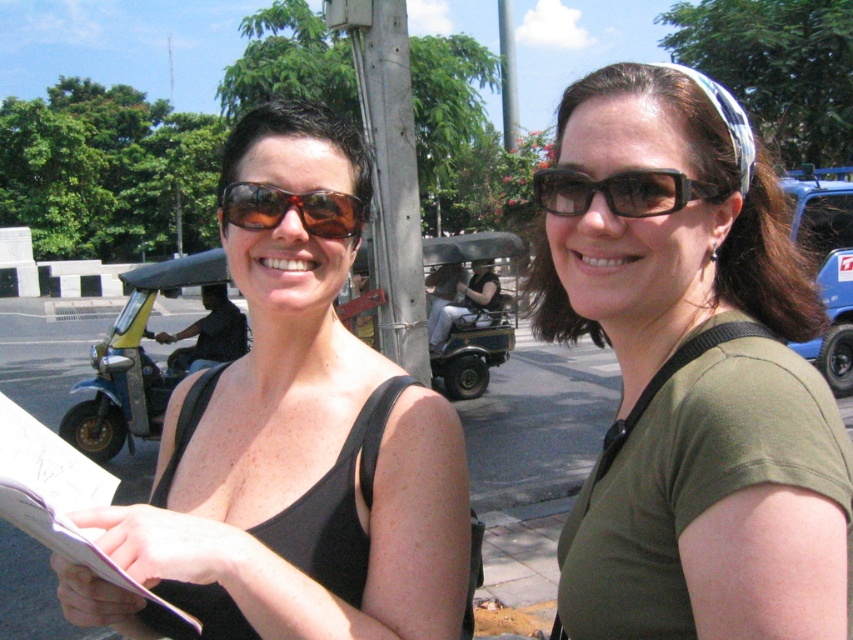
Question: Can you confirm if green matte shirt at center is bigger than yellow-green plastic motorcycle at left?

Choices:
 (A) yes
 (B) no

Answer: (B)

Question: Among these objects, which one is nearest to the camera?

Choices:
 (A) green matte shirt at center
 (B) yellow-green plastic motorcycle at left

Answer: (A)

Question: Can you confirm if green matte shirt at center is thinner than matte black tank top at left?

Choices:
 (A) no
 (B) yes

Answer: (B)

Question: From the image, what is the correct spatial relationship of black plastic sunglasses at upper center in relation to brown matte sunglasses at center?

Choices:
 (A) right
 (B) left

Answer: (A)

Question: Based on their relative distances, which object is farther from the black plastic sunglasses at upper center?

Choices:
 (A) yellow-green plastic motorcycle at left
 (B) brown matte sunglasses at center
 (C) matte black tank top at left

Answer: (A)

Question: Among these points, which one is nearest to the camera?

Choices:
 (A) (291, 202)
 (B) (90, 378)
 (C) (424, 608)
 (D) (646, 468)

Answer: (D)